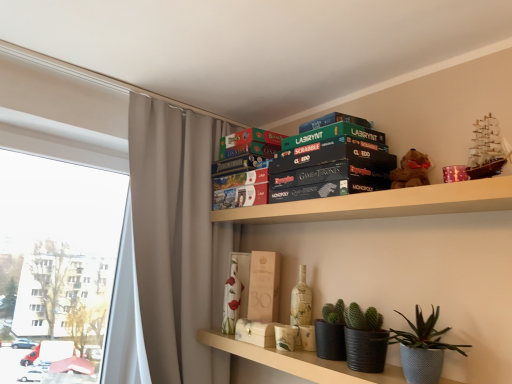
Question: From the image's perspective, would you say white textured vase at center, the 1th paperback book in the left-to-right sequence, is shown under wooden box at center, marked as the second paperback book in a top-to-bottom arrangement?

Choices:
 (A) no
 (B) yes

Answer: (B)

Question: Is white textured vase at center, positioned as the 3th paperback book in right-to-left order, closer to the viewer compared to wooden box at center, the 2th paperback book in the right-to-left sequence?

Choices:
 (A) no
 (B) yes

Answer: (A)

Question: Is white textured vase at center, positioned as the 3th paperback book in right-to-left order, not near wooden box at center, which is the 2th paperback book in left-to-right order?

Choices:
 (A) no
 (B) yes

Answer: (A)

Question: Are white textured vase at center, the 1th paperback book when ordered from bottom to top, and wooden box at center, marked as the second paperback book in a top-to-bottom arrangement, beside each other?

Choices:
 (A) yes
 (B) no

Answer: (B)

Question: Considering the relative sizes of white textured vase at center, the 1th paperback book in the left-to-right sequence, and wooden box at center, the 2th paperback book in the right-to-left sequence, in the image provided, is white textured vase at center, the 1th paperback book in the left-to-right sequence, taller than wooden box at center, the 2th paperback book in the right-to-left sequence,?

Choices:
 (A) yes
 (B) no

Answer: (B)

Question: Is white textured vase at center, the 1th paperback book when ordered from bottom to top, oriented away from wooden box at center, the 2th paperback book ordered from the bottom?

Choices:
 (A) no
 (B) yes

Answer: (A)

Question: Considering the relative sizes of gold textured vase at center and white textured vase at center, the 1th paperback book in the left-to-right sequence, in the image provided, is gold textured vase at center wider than white textured vase at center, the 1th paperback book in the left-to-right sequence,?

Choices:
 (A) no
 (B) yes

Answer: (B)

Question: Is gold textured vase at center smaller than white textured vase at center, positioned as the 3th paperback book in right-to-left order?

Choices:
 (A) no
 (B) yes

Answer: (A)

Question: From the image's perspective, is gold textured vase at center above white textured vase at center, positioned as the third paperback book in top-to-bottom order?

Choices:
 (A) no
 (B) yes

Answer: (A)

Question: Is the depth of gold textured vase at center greater than that of white textured vase at center, the 1th paperback book when ordered from bottom to top?

Choices:
 (A) yes
 (B) no

Answer: (B)

Question: Does gold textured vase at center have a larger size compared to white textured vase at center, the 1th paperback book in the left-to-right sequence?

Choices:
 (A) no
 (B) yes

Answer: (B)

Question: Is gold textured vase at center to the left of white textured vase at center, the 1th paperback book in the left-to-right sequence, from the viewer's perspective?

Choices:
 (A) yes
 (B) no

Answer: (B)

Question: Does matte black pots at lower center, which appears as the 2th shelf when viewed from the top, have a smaller size compared to white textured vase at center, the 1th paperback book when ordered from bottom to top?

Choices:
 (A) yes
 (B) no

Answer: (B)